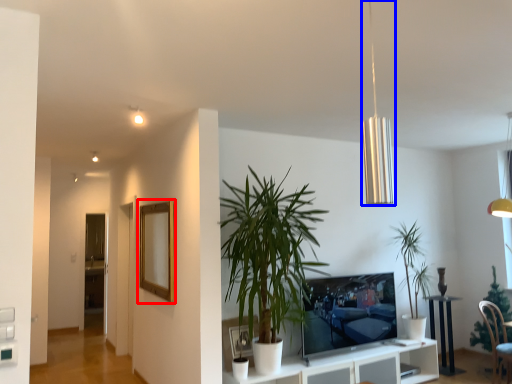
Question: Which of the following is the farthest to the observer, picture frame (highlighted by a red box) or lamp (highlighted by a blue box)?

Choices:
 (A) picture frame
 (B) lamp

Answer: (A)